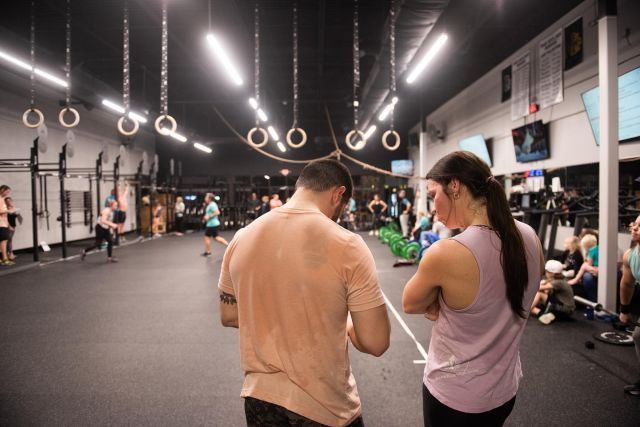
At what (x,y) coordinates should I click in order to perform the action: click on empty gym floor. Please return your answer as a coordinate pair (x, y). The image size is (640, 427). Looking at the image, I should click on (566, 387), (384, 386), (175, 392), (40, 384), (65, 301), (182, 311), (173, 249), (379, 250).